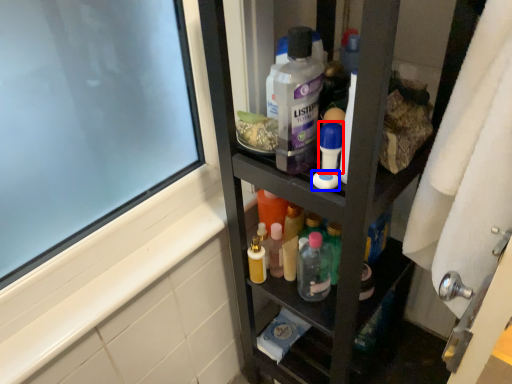
Question: Which of the following is the farthest to the observer, toiletry (highlighted by a red box) or soap (highlighted by a blue box)?

Choices:
 (A) toiletry
 (B) soap

Answer: (B)